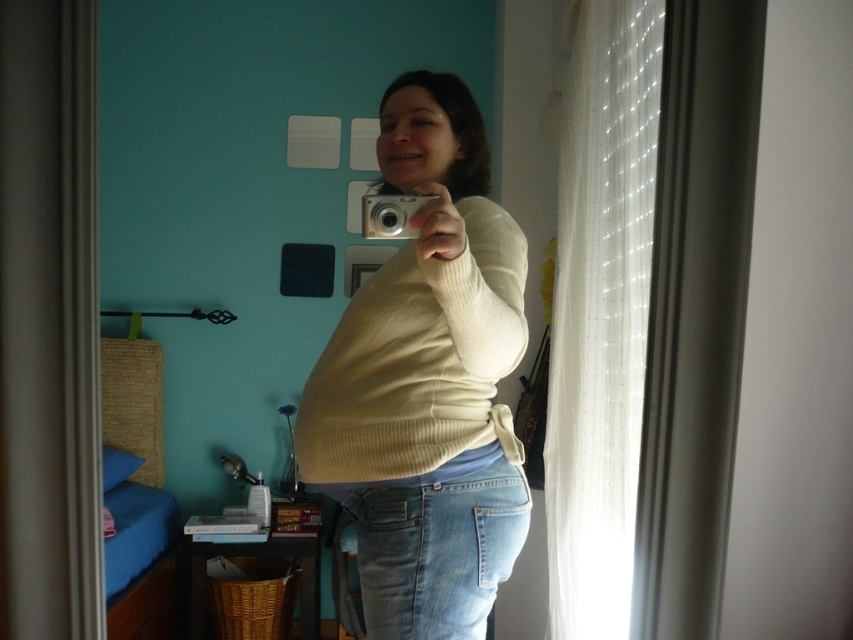
Based on the scene description, is the white ribbed sweater at center positioned higher than the light blue denim jeans at lower center?

Yes, the white ribbed sweater at center is located above the light blue denim jeans at lower center, so it is positioned higher.

You are a photographer trying to adjust your composition. You notice two points in the scene at coordinates point (569,589) and point (393,230). Which point is closer to the camera?

Point (393,230) is closer to the camera than point (569,589).

You are a photographer trying to capture the reflection in the mirror. You notice the light blue denim jeans at lower center and the silver metallic camera at center. Which object is positioned to the right of the other?

The light blue denim jeans at lower center are to the right of the silver metallic camera at center.